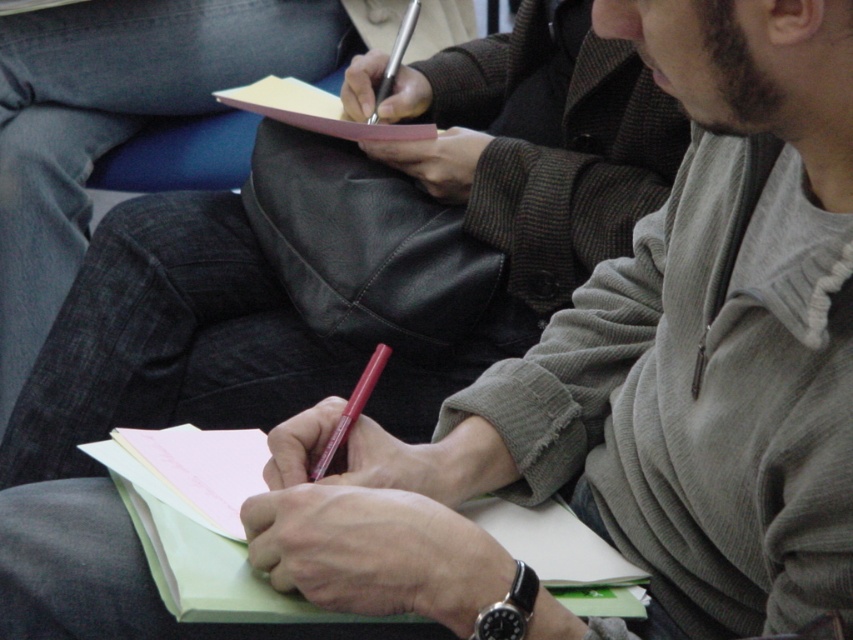
You have two writing tools in front of you, a matte pink pencil at center and a metallic silver pen at upper center. Which one is thinner?

The matte pink pencil at center is thinner than the metallic silver pen at upper center.

You are an artist trying to sketch the scene. You need to decide which object to focus on first based on their positions. Which object is nearer to you, the matte pink pencil at center or the metallic silver pen at upper center?

The matte pink pencil at center is closer to the viewer than the metallic silver pen at upper center, so you should focus on the matte pink pencil at center first.